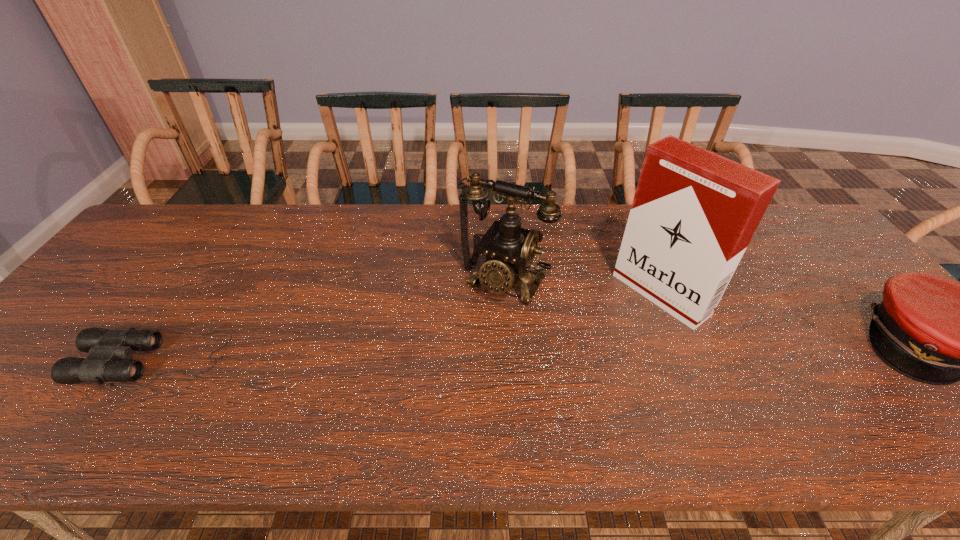
The height and width of the screenshot is (540, 960). Find the location of `vacant space at the left edge`. vacant space at the left edge is located at coordinates [x=23, y=370].

In the image, there is a desktop. Where is `vacant space at the right edge`? The height and width of the screenshot is (540, 960). vacant space at the right edge is located at coordinates (862, 323).

In the image, there is a desktop. In order to click on blank space at the far left corner in this screenshot , I will do `click(158, 230)`.

In the image, there is a desktop. In order to click on vacant space at the far right corner in this screenshot , I will do `click(803, 220)`.

In the image, there is a desktop. Where is `vacant space at the near right corner`? Image resolution: width=960 pixels, height=540 pixels. vacant space at the near right corner is located at coordinates (915, 397).

The width and height of the screenshot is (960, 540). What are the coordinates of `free space between the third object from right to left and the shortest object` in the screenshot? It's located at (329, 320).

This screenshot has height=540, width=960. What are the coordinates of `unoccupied area between the cigarette_case and the leftmost object` in the screenshot? It's located at (408, 327).

I want to click on vacant point located between the tallest object and the third object from right to left, so click(x=583, y=287).

Find the location of a particular element. empty space that is in between the second object from left to right and the leftmost object is located at coordinates (329, 320).

This screenshot has width=960, height=540. I want to click on vacant region between the third object from right to left and the shortest object, so click(x=329, y=320).